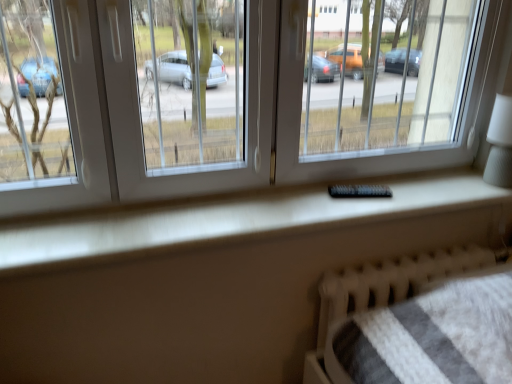
Question: Considering the positions of point (349, 188) and point (397, 266), is point (349, 188) closer or farther from the camera than point (397, 266)?

Choices:
 (A) closer
 (B) farther

Answer: (A)

Question: From the image's perspective, is black plastic remote at center positioned above or below white knitted hospital bed at lower right?

Choices:
 (A) below
 (B) above

Answer: (B)

Question: Based on their relative distances, which object is farther from the black plastic remote at center?

Choices:
 (A) white textured lampshade at right
 (B) transparent plastic window at center
 (C) white knitted hospital bed at lower right

Answer: (A)

Question: Estimate the real-world distances between objects in this image. Which object is closer to the white knitted hospital bed at lower right?

Choices:
 (A) white textured lampshade at right
 (B) transparent plastic window at center
 (C) black plastic remote at center

Answer: (C)